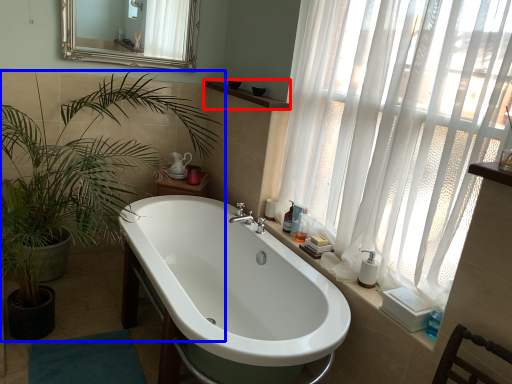
Question: Among these objects, which one is farthest to the camera, balustrade (highlighted by a red box) or houseplant (highlighted by a blue box)?

Choices:
 (A) balustrade
 (B) houseplant

Answer: (A)